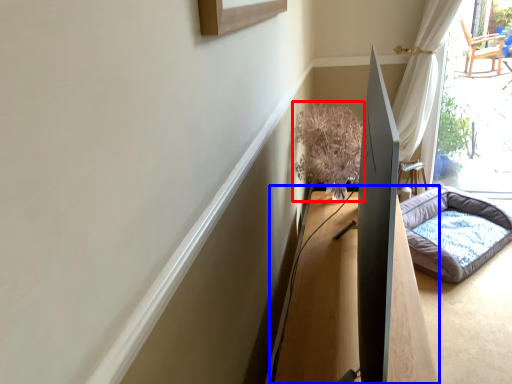
Question: Which object is closer to the camera taking this photo, plant (highlighted by a red box) or table (highlighted by a blue box)?

Choices:
 (A) plant
 (B) table

Answer: (B)